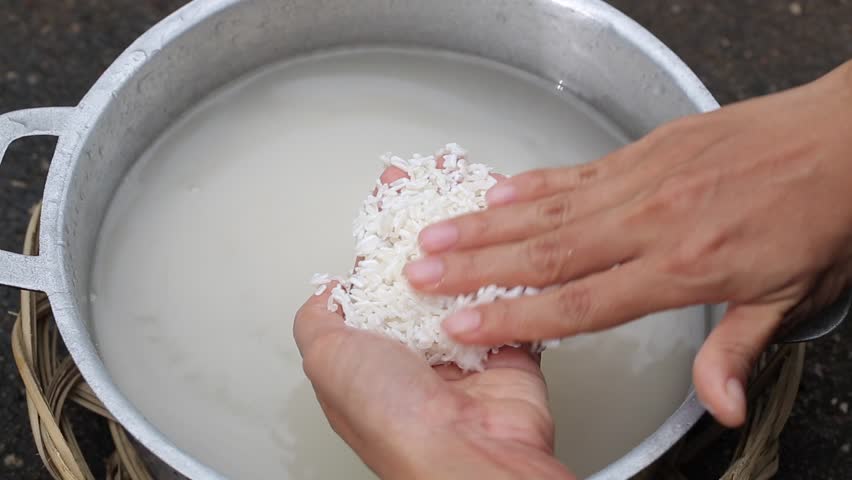
At what (x,y) coordinates should I click in order to perform the action: click on pot. Please return your answer as a coordinate pair (x, y). Looking at the image, I should click on (642, 85).